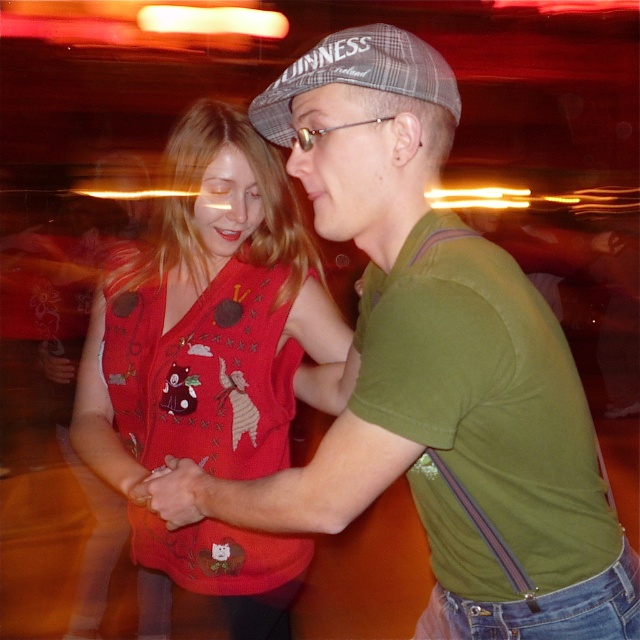
Question: Which point is closer to the camera?

Choices:
 (A) plaid fabric baseball cap at upper center
 (B) matte red sweater vest at center

Answer: (A)

Question: Which object is farther from the camera taking this photo?

Choices:
 (A) plaid fabric baseball cap at upper center
 (B) matte red sweater vest at center

Answer: (B)

Question: Does matte red sweater vest at center have a lesser width compared to plaid fabric baseball cap at upper center?

Choices:
 (A) yes
 (B) no

Answer: (B)

Question: Which object is farther from the camera taking this photo?

Choices:
 (A) plaid fabric baseball cap at upper center
 (B) matte red sweater vest at center

Answer: (B)

Question: Does matte red sweater vest at center appear on the right side of plaid fabric baseball cap at upper center?

Choices:
 (A) yes
 (B) no

Answer: (B)

Question: Can you confirm if matte red sweater vest at center is smaller than plaid fabric baseball cap at upper center?

Choices:
 (A) no
 (B) yes

Answer: (A)